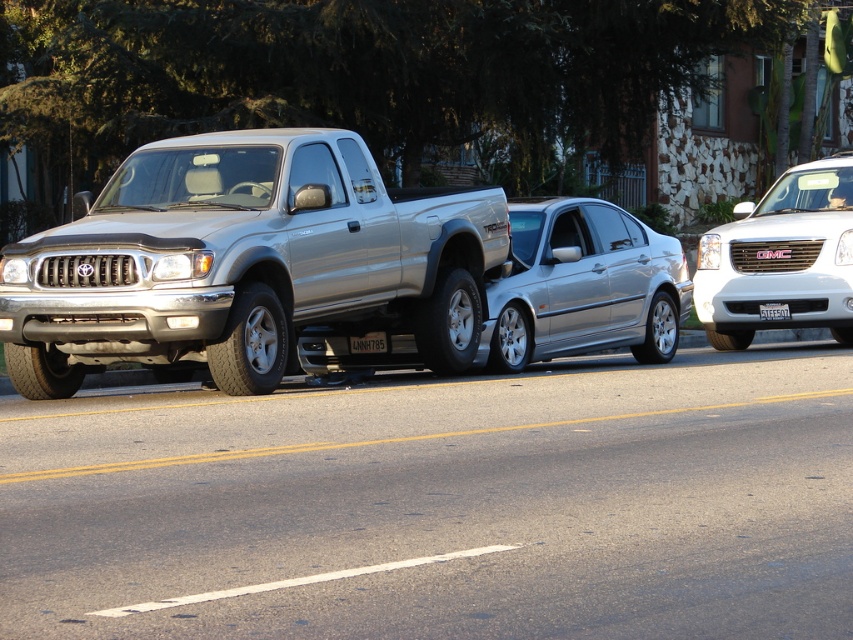
Between white glossy suv at upper right and black plastic license plate at center, which one appears on the left side from the viewer's perspective?

Positioned to the left is black plastic license plate at center.

This screenshot has width=853, height=640. In order to click on white glossy suv at upper right in this screenshot , I will do `click(781, 257)`.

Between point (723, 227) and point (374, 342), which one is positioned in front?

Positioned in front is point (374, 342).

Locate an element on the screen. white glossy suv at upper right is located at coordinates (781, 257).

The height and width of the screenshot is (640, 853). What do you see at coordinates (248, 262) in the screenshot? I see `silver metallic truck at center` at bounding box center [248, 262].

Identify the location of silver metallic truck at center. (248, 262).

This screenshot has width=853, height=640. In order to click on silver metallic truck at center in this screenshot , I will do `click(248, 262)`.

Who is shorter, white glossy suv at upper right or white plastic license plate at center?

white plastic license plate at center is shorter.

Between white glossy suv at upper right and white plastic license plate at center, which one has more height?

With more height is white glossy suv at upper right.

Is point (787, 212) less distant than point (770, 305)?

No, (787, 212) is behind (770, 305).

Identify the location of white glossy suv at upper right. (781, 257).